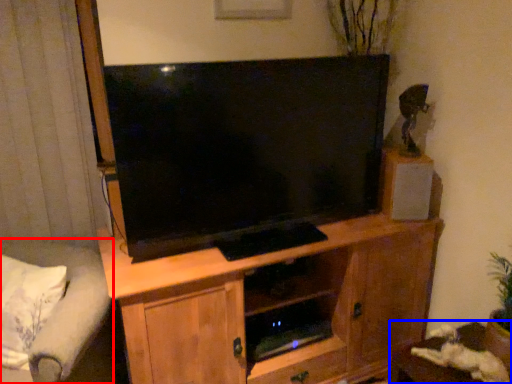
Question: Among these objects, which one is nearest to the camera, studio couch (highlighted by a red box) or table (highlighted by a blue box)?

Choices:
 (A) studio couch
 (B) table

Answer: (A)